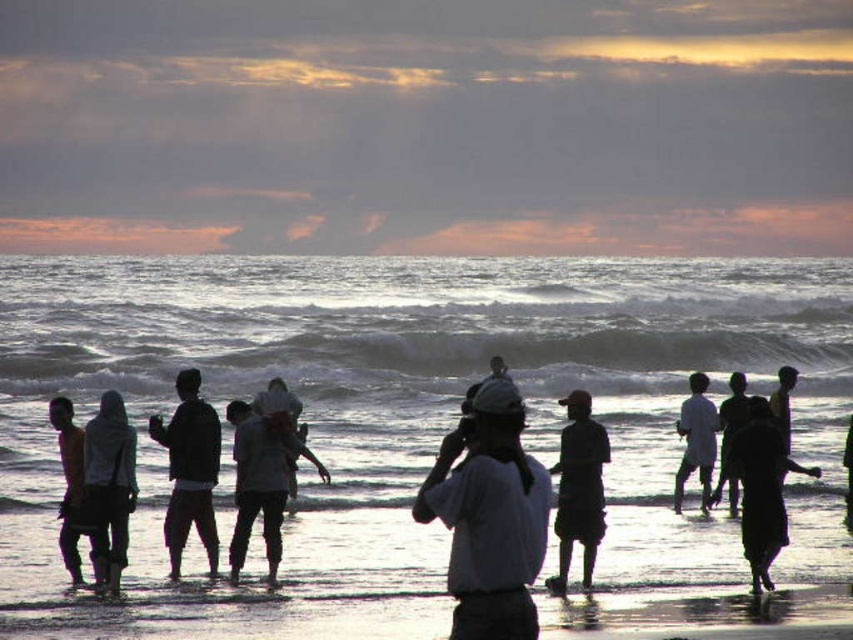
Who is positioned more to the left, dark matte clothing at center or dark skin human at center?

dark skin human at center

Does dark matte clothing at center have a greater height compared to dark skin human at center?

In fact, dark matte clothing at center may be shorter than dark skin human at center.

Where is `dark matte clothing at center`? dark matte clothing at center is located at coordinates (189, 468).

Does white fabric headscarf at center have a greater width compared to dark gray fabric dress at center right?

Incorrect, white fabric headscarf at center's width does not surpass dark gray fabric dress at center right's.

Who is lower down, white fabric headscarf at center or dark gray fabric dress at center right?

Positioned lower is white fabric headscarf at center.

Is point (103, 522) behind point (721, 420)?

No.

What are the coordinates of `white fabric headscarf at center` in the screenshot? It's located at (109, 486).

Does black fabric dress at lower right appear on the left side of dark gray fabric cap at center?

Incorrect, black fabric dress at lower right is not on the left side of dark gray fabric cap at center.

Who is positioned more to the left, black fabric dress at lower right or dark gray fabric cap at center?

dark gray fabric cap at center is more to the left.

I want to click on black fabric dress at lower right, so click(762, 488).

Image resolution: width=853 pixels, height=640 pixels. Find the location of `black fabric dress at lower right`. black fabric dress at lower right is located at coordinates (762, 488).